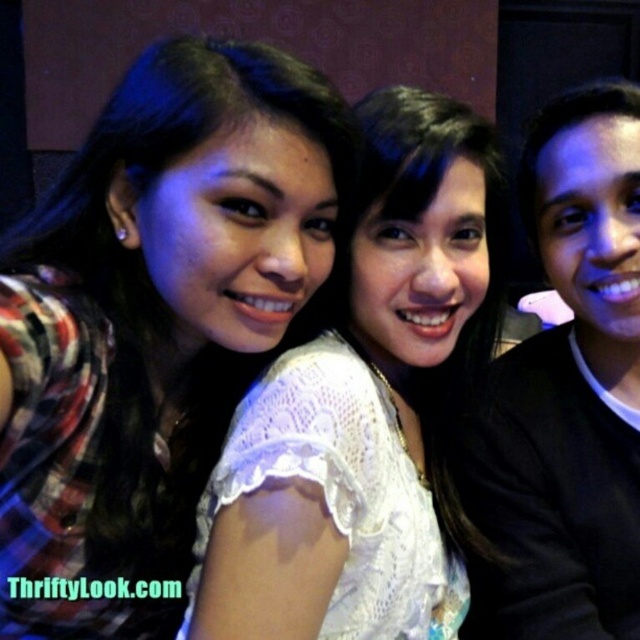
Question: Which object is the farthest from the white lace blouse at center?

Choices:
 (A) black matte shirt at right
 (B) plaid fabric shirt at left

Answer: (A)

Question: Can you confirm if plaid fabric shirt at left is thinner than black matte shirt at right?

Choices:
 (A) yes
 (B) no

Answer: (B)

Question: Is white lace blouse at center closer to camera compared to black matte shirt at right?

Choices:
 (A) no
 (B) yes

Answer: (B)

Question: Estimate the real-world distances between objects in this image. Which object is farther from the white lace blouse at center?

Choices:
 (A) black matte shirt at right
 (B) plaid fabric shirt at left

Answer: (A)

Question: Which of the following is the farthest from the observer?

Choices:
 (A) (108, 253)
 (B) (492, 417)

Answer: (B)

Question: Does plaid fabric shirt at left have a lesser width compared to white lace blouse at center?

Choices:
 (A) yes
 (B) no

Answer: (A)